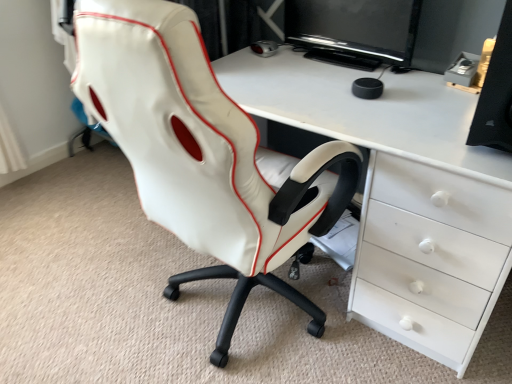
This screenshot has height=384, width=512. Identify the location of blank space above white glossy desk at center (from a real-world perspective). (321, 86).